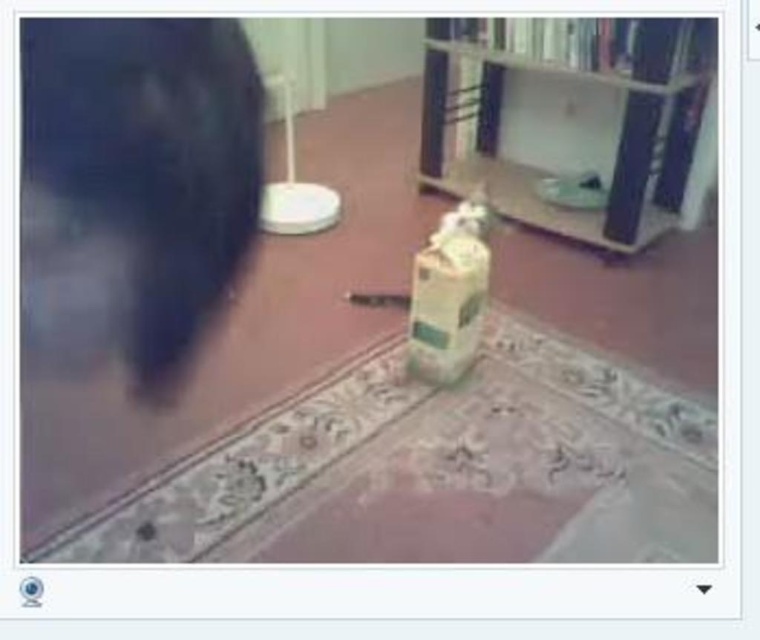
Question: Is white glossy bookshelf at upper center above matte plastic bottle at center?

Choices:
 (A) yes
 (B) no

Answer: (A)

Question: Does white glossy bookshelf at upper center have a smaller size compared to matte plastic bottle at center?

Choices:
 (A) yes
 (B) no

Answer: (B)

Question: Does white glossy bookshelf at upper center appear under matte plastic bottle at center?

Choices:
 (A) yes
 (B) no

Answer: (B)

Question: Which point appears closest to the camera in this image?

Choices:
 (A) (464, 113)
 (B) (442, 323)

Answer: (B)

Question: Which object appears farthest from the camera in this image?

Choices:
 (A) matte plastic bottle at center
 (B) white glossy bookshelf at upper center

Answer: (B)